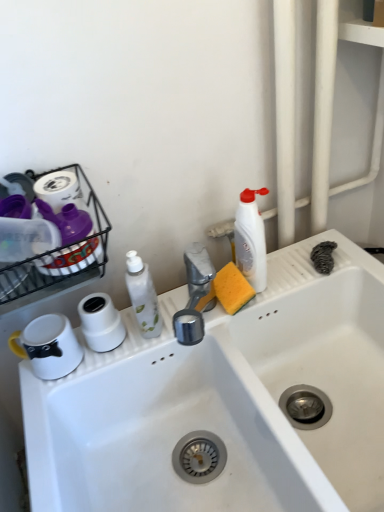
Question: Considering the relative positions of white plastic bottle at upper right, which is the first cleaning product in right-to-left order, and white matte toilet paper at center in the image provided, is white plastic bottle at upper right, which is the first cleaning product in right-to-left order, to the right of white matte toilet paper at center from the viewer's perspective?

Choices:
 (A) no
 (B) yes

Answer: (B)

Question: Does white plastic bottle at upper right, which is the first cleaning product in right-to-left order, have a greater width compared to white matte toilet paper at center?

Choices:
 (A) no
 (B) yes

Answer: (B)

Question: Is white plastic bottle at upper right, which is the first cleaning product in right-to-left order, not close to white matte toilet paper at center?

Choices:
 (A) yes
 (B) no

Answer: (B)

Question: Is white plastic bottle at upper right, which is the first cleaning product in right-to-left order, outside white matte toilet paper at center?

Choices:
 (A) no
 (B) yes

Answer: (B)

Question: Could white matte toilet paper at center be considered to be inside white plastic bottle at upper right, which is the first cleaning product in right-to-left order?

Choices:
 (A) no
 (B) yes

Answer: (A)

Question: From the image's perspective, is white plastic bottle at upper right, which is the first cleaning product in right-to-left order, on top of white matte toilet paper at center?

Choices:
 (A) yes
 (B) no

Answer: (A)

Question: From a real-world perspective, is white glossy sink at center under white glossy bottle at center, marked as the first cleaning product in a left-to-right arrangement?

Choices:
 (A) yes
 (B) no

Answer: (A)

Question: From a real-world perspective, is white glossy sink at center over white glossy bottle at center, which is the 2th cleaning product from right to left?

Choices:
 (A) no
 (B) yes

Answer: (A)

Question: Is white glossy sink at center to the left of white glossy bottle at center, marked as the first cleaning product in a left-to-right arrangement, from the viewer's perspective?

Choices:
 (A) yes
 (B) no

Answer: (B)

Question: Is white glossy sink at center wider than white glossy bottle at center, marked as the first cleaning product in a left-to-right arrangement?

Choices:
 (A) yes
 (B) no

Answer: (A)

Question: Does white glossy sink at center have a larger size compared to white glossy bottle at center, which is the 2th cleaning product from right to left?

Choices:
 (A) no
 (B) yes

Answer: (B)

Question: Does white glossy sink at center have a greater height compared to white glossy bottle at center, which is the 2th cleaning product from right to left?

Choices:
 (A) no
 (B) yes

Answer: (B)

Question: Does white matte toilet paper at center have a lesser width compared to white plastic bottle at upper right, which is the first cleaning product in right-to-left order?

Choices:
 (A) no
 (B) yes

Answer: (B)